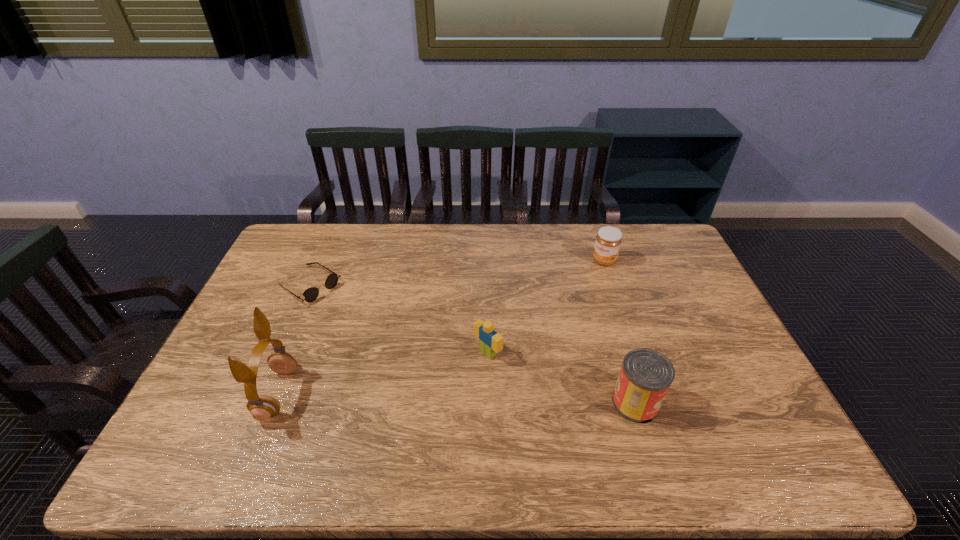
Locate an element on the screen. can that is at the near edge is located at coordinates pyautogui.click(x=646, y=375).

You are a GUI agent. You are given a task and a screenshot of the screen. Output one action in this format:
    pyautogui.click(x=<x>, y=<y>)
    Task: Click on the earphone located at the left edge
    The width and height of the screenshot is (960, 540).
    Given the screenshot: What is the action you would take?
    pyautogui.click(x=262, y=407)

The image size is (960, 540). I want to click on sunglasses present at the left edge, so click(x=311, y=294).

Locate an element on the screen. This screenshot has width=960, height=540. object that is at the near left corner is located at coordinates (262, 407).

The image size is (960, 540). I want to click on vacant space at the far edge of the desktop, so coord(511,226).

Where is `vacant space at the left edge of the desktop`? The width and height of the screenshot is (960, 540). vacant space at the left edge of the desktop is located at coordinates (223, 391).

Where is `vacant area at the right edge`? The width and height of the screenshot is (960, 540). vacant area at the right edge is located at coordinates (688, 361).

This screenshot has height=540, width=960. In the image, there is a desktop. In order to click on vacant area at the far left corner in this screenshot , I will do `click(293, 239)`.

At what (x,y) coordinates should I click in order to perform the action: click on free space between the shortest object and the tallest object. Please return your answer as a coordinate pair (x, y). Looking at the image, I should click on (294, 339).

The width and height of the screenshot is (960, 540). Find the location of `empty space between the earphone and the sunglasses`. empty space between the earphone and the sunglasses is located at coordinates pos(294,339).